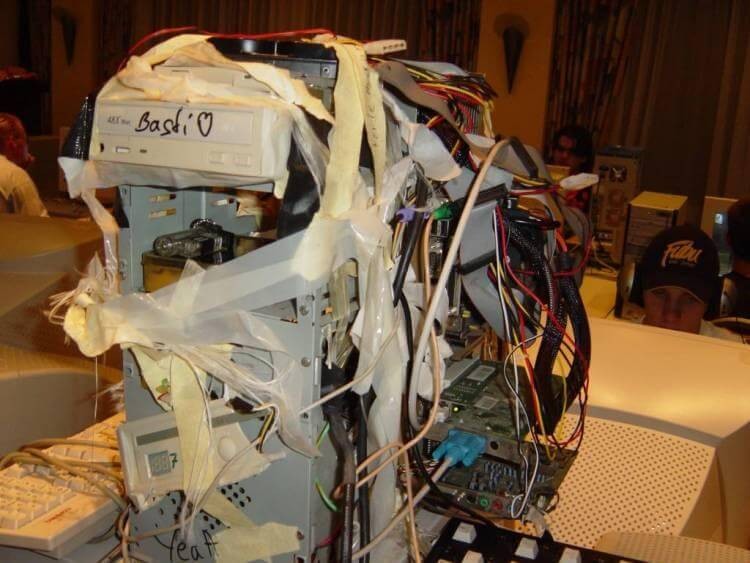
Identify the location of wires. This screenshot has width=750, height=563. (524, 281), (530, 309), (526, 370), (526, 411), (518, 420), (256, 406), (460, 92), (252, 32).